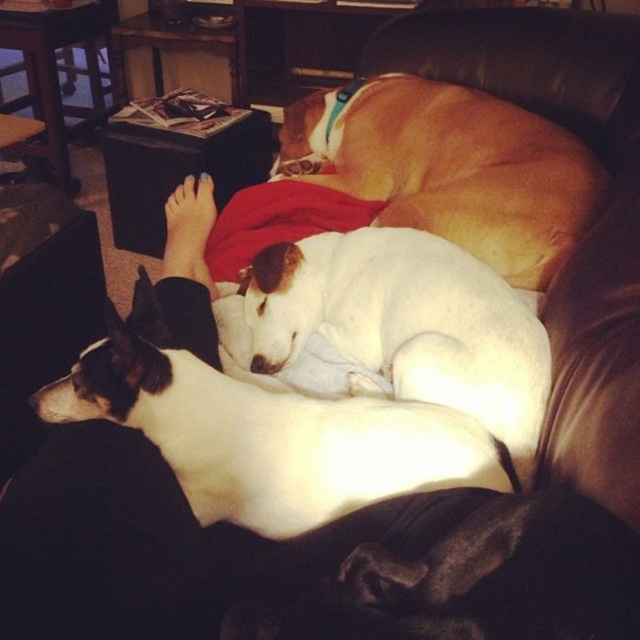
You are a photographer trying to capture a closeup of the white smooth dog at center. Based on its position coordinates, where should you aim your camera?

The white smooth dog at center is located at coordinates point (264, 433), so aim your camera at that position to capture it.